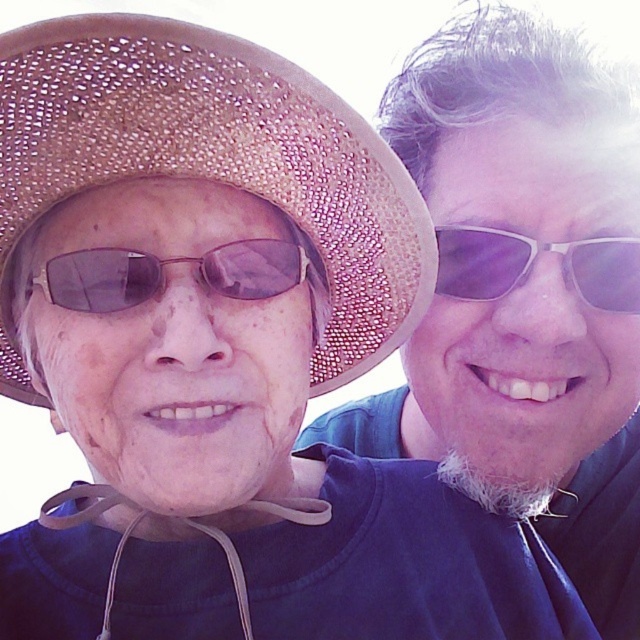
You are taking a photo of two people standing side by side. You notice a strawhat at center and sunglassestransparentglasses at right. Which object is closer to the camera?

The strawhat at center is closer to the viewer than the sunglassestransparentglasses at right.

You are standing in front of the image. There is a point at coordinates (218, 156). What object is located at that point?

The point at (218, 156) corresponds to the strawhat at center.

You are standing at the point marked as point (424,444) and want to take a photo of the two people in the scene. The camera you have can only focus on subjects within 1.5 meters. Will the camera be able to focus on the two people?

The point marked as point (424,444) and the camera are 1.59 meters apart. Since the camera can only focus on subjects within 1.5 meters, the distance is slightly beyond the camera range. Therefore, the camera will not be able to focus on the two people.